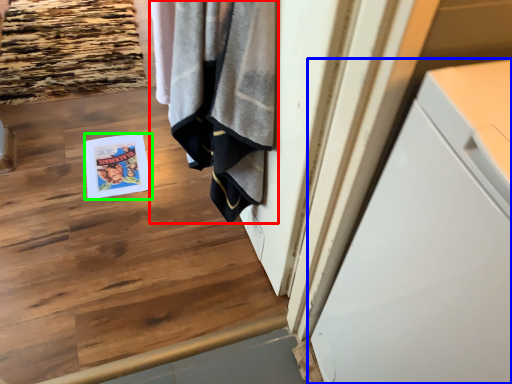
Question: Estimate the real-world distances between objects in this image. Which object is closer to bath towel (highlighted by a red box), cabinetry (highlighted by a blue box) or magazine (highlighted by a green box)?

Choices:
 (A) cabinetry
 (B) magazine

Answer: (A)